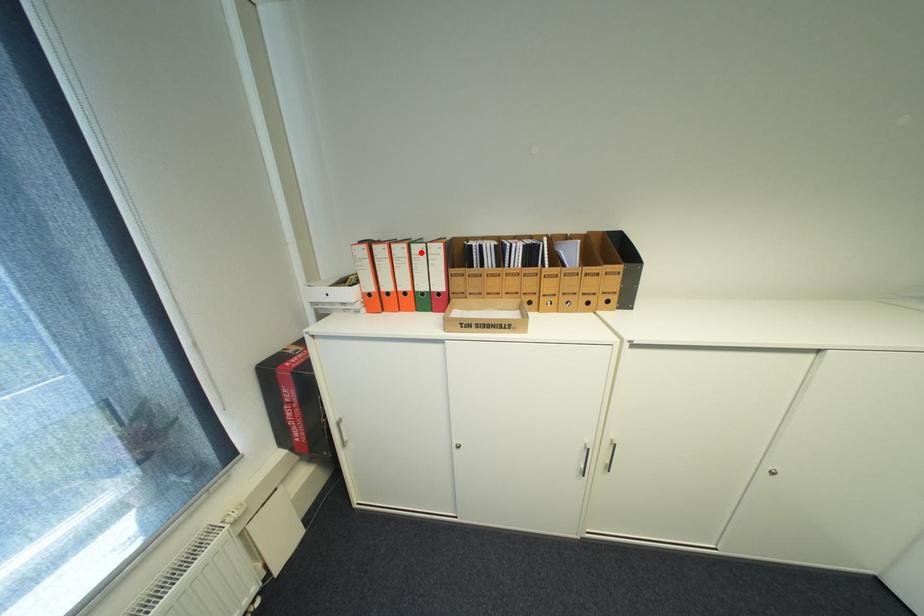
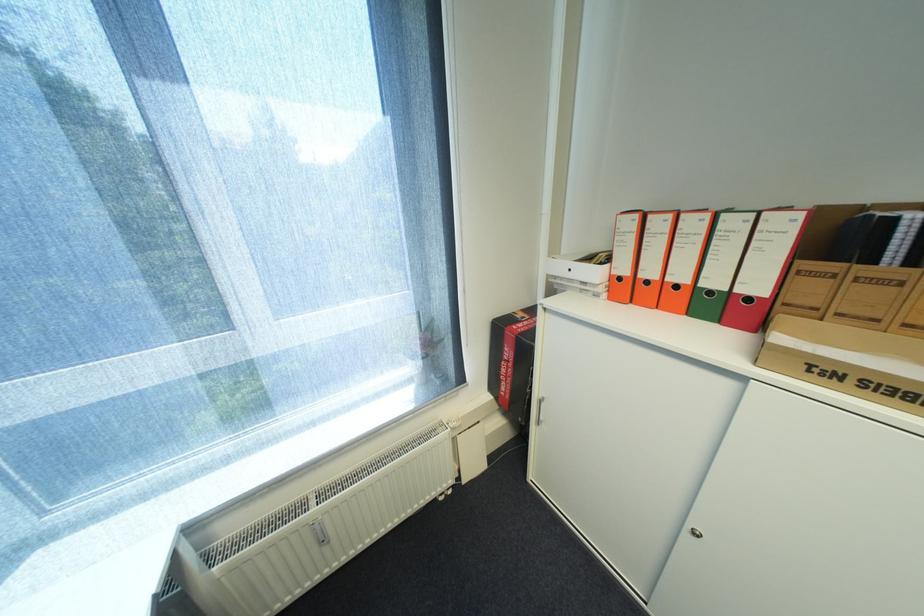
Find the pixel in the second image that matches the highlighted location in the first image.

(727, 227)